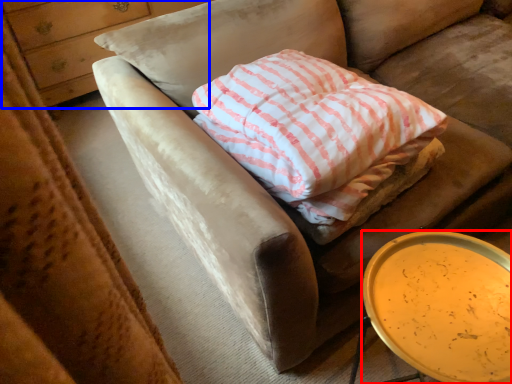
Question: Which point is further to the camera, table (highlighted by a red box) or dresser (highlighted by a blue box)?

Choices:
 (A) table
 (B) dresser

Answer: (B)